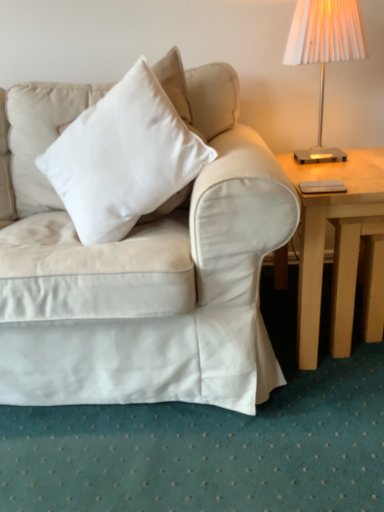
Question: Does satin white couch at center lie behind white soft cushion at upper left?

Choices:
 (A) no
 (B) yes

Answer: (A)

Question: Does satin white couch at center have a greater width compared to white soft cushion at upper left?

Choices:
 (A) no
 (B) yes

Answer: (B)

Question: Is satin white couch at center with white soft cushion at upper left?

Choices:
 (A) yes
 (B) no

Answer: (B)

Question: Can you confirm if satin white couch at center is bigger than white soft cushion at upper left?

Choices:
 (A) yes
 (B) no

Answer: (A)

Question: From the image's perspective, is satin white couch at center on top of white soft cushion at upper left?

Choices:
 (A) no
 (B) yes

Answer: (A)

Question: Is satin white couch at center far away from white soft cushion at upper left?

Choices:
 (A) no
 (B) yes

Answer: (A)

Question: Does metallic silver lampshade at upper right have a greater height compared to white soft cushion at upper left?

Choices:
 (A) no
 (B) yes

Answer: (A)

Question: Is metallic silver lampshade at upper right further to camera compared to white soft cushion at upper left?

Choices:
 (A) yes
 (B) no

Answer: (A)

Question: Is metallic silver lampshade at upper right smaller than white soft cushion at upper left?

Choices:
 (A) yes
 (B) no

Answer: (A)

Question: Is metallic silver lampshade at upper right closer to camera compared to white soft cushion at upper left?

Choices:
 (A) yes
 (B) no

Answer: (B)

Question: From the image's perspective, is metallic silver lampshade at upper right under white soft cushion at upper left?

Choices:
 (A) no
 (B) yes

Answer: (A)

Question: Is metallic silver lampshade at upper right far from white soft cushion at upper left?

Choices:
 (A) no
 (B) yes

Answer: (A)

Question: Is satin white couch at center oriented away from light wood table at right?

Choices:
 (A) no
 (B) yes

Answer: (A)